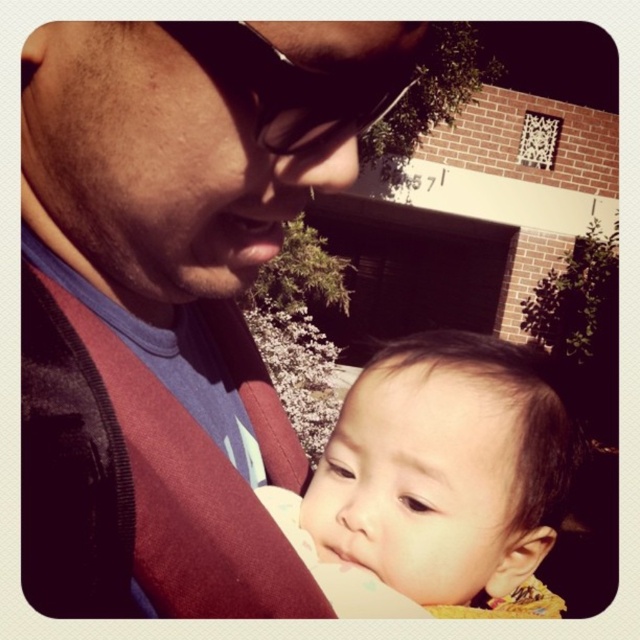
You are a photographer trying to capture a closeup of the adult and baby. Since the matte blue shirt at center and the smooth skin baby at center are both at the center, which one is wider?

The matte blue shirt at center is narrower than the smooth skin baby at center because the matte blue shirt at center has a smaller width compared to the smooth skin baby at center.

You are a photographer adjusting the camera focus. The matte blue shirt at center and the smooth skin baby at center are both in the frame. Which object should you focus on first if you want to ensure the taller one is in sharp focus?

The matte blue shirt at center is taller than the smooth skin baby at center, so you should focus on the matte blue shirt at center first to ensure the taller object is in sharp focus.

You are taking a photo of the scene and want to focus on the point closer to the camera. Which point should you choose between point (x=52, y=468) and point (x=467, y=602)?

Point (x=52, y=468) is closer to the camera than point (x=467, y=602), so you should choose point (x=52, y=468) to focus on.